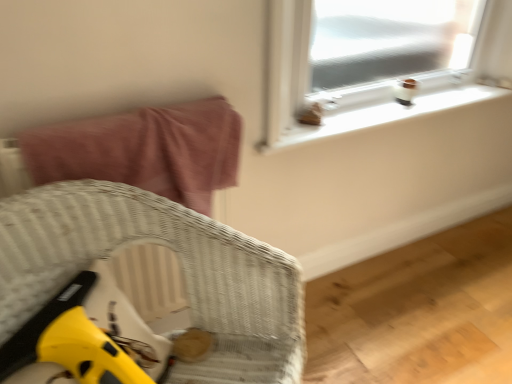
Where is `woven wicker chair at lower left`? This screenshot has width=512, height=384. woven wicker chair at lower left is located at coordinates (183, 266).

Which object is thinner, woven wicker chair at lower left or white plastic window sill at upper right?

With smaller width is white plastic window sill at upper right.

Is woven wicker chair at lower left smaller than white plastic window sill at upper right?

No.

From the image's perspective, relative to white plastic window sill at upper right, is woven wicker chair at lower left above or below?

woven wicker chair at lower left is situated lower than white plastic window sill at upper right in the image.

Which is in front, point (223, 282) or point (86, 176)?

The point (223, 282) is more forward.

Would you say pink fabric bed at upper left is part of woven wicker chair at lower left's contents?

No, pink fabric bed at upper left is not a part of woven wicker chair at lower left.

Is woven wicker chair at lower left placed right next to pink fabric bed at upper left?

No, woven wicker chair at lower left is not in contact with pink fabric bed at upper left.

Identify the location of bed located above the woven wicker chair at lower left (from a real-world perspective). This screenshot has height=384, width=512. (144, 150).

Considering the relative sizes of white plastic window sill at upper right and pink fabric bed at upper left in the image provided, is white plastic window sill at upper right wider than pink fabric bed at upper left?

No, white plastic window sill at upper right is not wider than pink fabric bed at upper left.

Is white plastic window sill at upper right located outside pink fabric bed at upper left?

A: Yes.

Where is `bed that is in front of the white plastic window sill at upper right`? The image size is (512, 384). bed that is in front of the white plastic window sill at upper right is located at coordinates (144, 150).

Considering the relative positions of pink fabric bed at upper left and white plastic window sill at upper right in the image provided, is pink fabric bed at upper left to the left or to the right of white plastic window sill at upper right?

In the image, pink fabric bed at upper left appears on the left side of white plastic window sill at upper right.

Is white plastic window sill at upper right completely or partially inside pink fabric bed at upper left?

No, white plastic window sill at upper right is not surrounded by pink fabric bed at upper left.

Does pink fabric bed at upper left have a larger size compared to white plastic window sill at upper right?

Yes.

Is pink fabric bed at upper left not within woven wicker chair at lower left?

Yes.

Does pink fabric bed at upper left have a lesser height compared to woven wicker chair at lower left?

Indeed, pink fabric bed at upper left has a lesser height compared to woven wicker chair at lower left.

Is point (29, 166) in front of point (28, 261)?

No, it is behind (28, 261).

From a real-world perspective, which object rests below the other?

woven wicker chair at lower left.

Considering the relative sizes of white plastic window sill at upper right and woven wicker chair at lower left in the image provided, is white plastic window sill at upper right thinner than woven wicker chair at lower left?

Yes.

Locate an element on the screen. This screenshot has width=512, height=384. window sill behind the woven wicker chair at lower left is located at coordinates (384, 115).

Is white plastic window sill at upper right taller than woven wicker chair at lower left?

Incorrect, the height of white plastic window sill at upper right is not larger of that of woven wicker chair at lower left.

Measure the distance between white plastic window sill at upper right and woven wicker chair at lower left.

62.16 centimeters.

The image size is (512, 384). I want to click on furniture directly beneath the white plastic window sill at upper right (from a real-world perspective), so click(183, 266).

Identify the location of furniture in front of the pink fabric bed at upper left. (183, 266).

Looking at the image, which one is located closer to woven wicker chair at lower left, pink fabric bed at upper left or white plastic window sill at upper right?

Among the two, pink fabric bed at upper left is located nearer to woven wicker chair at lower left.

Looking at the image, which one is located closer to woven wicker chair at lower left, white plastic window sill at upper right or pink fabric bed at upper left?

pink fabric bed at upper left is positioned closer to the anchor woven wicker chair at lower left.

When comparing their distances from pink fabric bed at upper left, does white plastic window sill at upper right or woven wicker chair at lower left seem further?

Among the two, white plastic window sill at upper right is located further to pink fabric bed at upper left.

Estimate the real-world distances between objects in this image. Which object is further from white plastic window sill at upper right, pink fabric bed at upper left or woven wicker chair at lower left?

woven wicker chair at lower left is further to white plastic window sill at upper right.

In the scene shown: Based on their spatial positions, is woven wicker chair at lower left or white plastic window sill at upper right further from pink fabric bed at upper left?

white plastic window sill at upper right lies further to pink fabric bed at upper left than the other object.

When comparing their distances from white plastic window sill at upper right, does woven wicker chair at lower left or pink fabric bed at upper left seem closer?

pink fabric bed at upper left.

I want to click on furniture situated between pink fabric bed at upper left and white plastic window sill at upper right from left to right, so click(x=183, y=266).